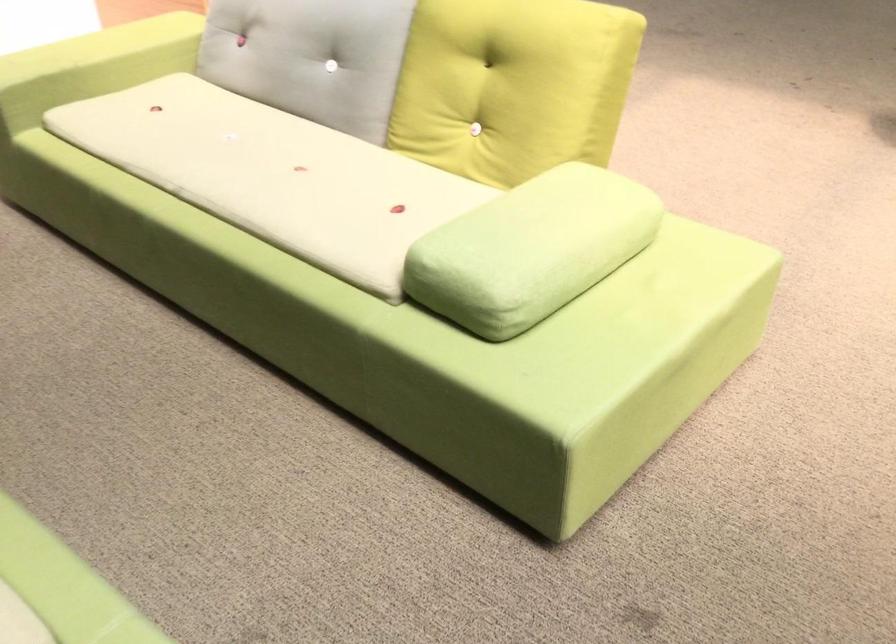
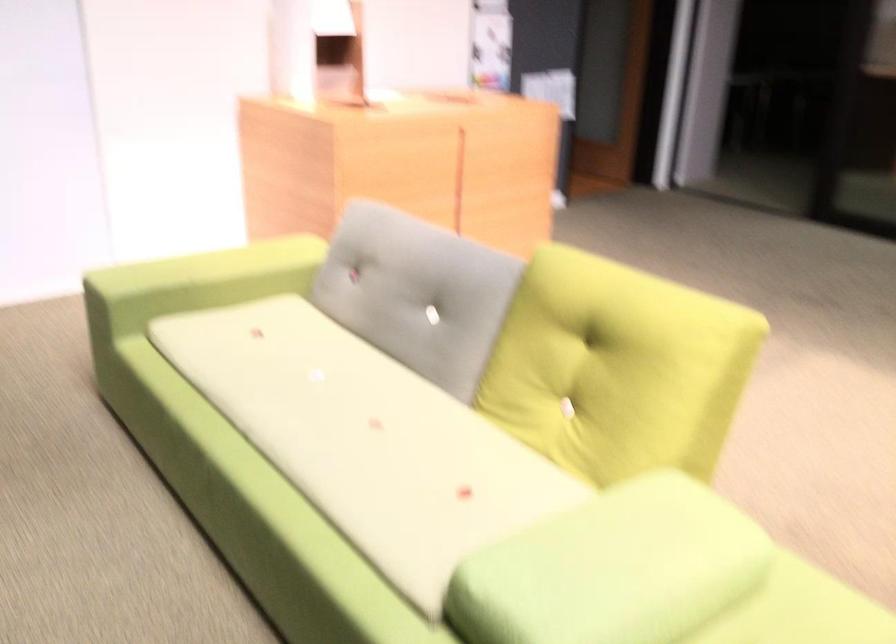
Find the pixel in the second image that matches pixel 297 182 in the first image.

(366, 439)